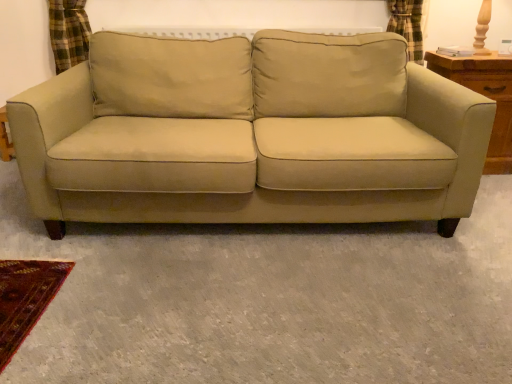
Question: Does wooden dresser at right have a greater width compared to suede-like beige couch at center?

Choices:
 (A) yes
 (B) no

Answer: (B)

Question: From the image's perspective, would you say wooden dresser at right is positioned over suede-like beige couch at center?

Choices:
 (A) yes
 (B) no

Answer: (A)

Question: Is wooden dresser at right positioned with its back to suede-like beige couch at center?

Choices:
 (A) yes
 (B) no

Answer: (B)

Question: Is wooden dresser at right taller than suede-like beige couch at center?

Choices:
 (A) no
 (B) yes

Answer: (A)

Question: Is wooden dresser at right to the right of suede-like beige couch at center from the viewer's perspective?

Choices:
 (A) no
 (B) yes

Answer: (B)

Question: Is wooden dresser at right bigger than suede-like beige couch at center?

Choices:
 (A) no
 (B) yes

Answer: (A)

Question: Is the surface of suede-like beige couch at center in direct contact with wooden dresser at right?

Choices:
 (A) yes
 (B) no

Answer: (B)

Question: Are suede-like beige couch at center and wooden dresser at right located far from each other?

Choices:
 (A) no
 (B) yes

Answer: (A)

Question: Is suede-like beige couch at center behind wooden dresser at right?

Choices:
 (A) yes
 (B) no

Answer: (B)

Question: From a real-world perspective, is suede-like beige couch at center on top of wooden dresser at right?

Choices:
 (A) no
 (B) yes

Answer: (B)

Question: Can you confirm if suede-like beige couch at center is positioned to the right of wooden dresser at right?

Choices:
 (A) yes
 (B) no

Answer: (B)

Question: Is suede-like beige couch at center thinner than wooden dresser at right?

Choices:
 (A) no
 (B) yes

Answer: (A)

Question: From a real-world perspective, relative to suede-like beige couch at center, is wooden dresser at right vertically above or below?

Choices:
 (A) above
 (B) below

Answer: (B)